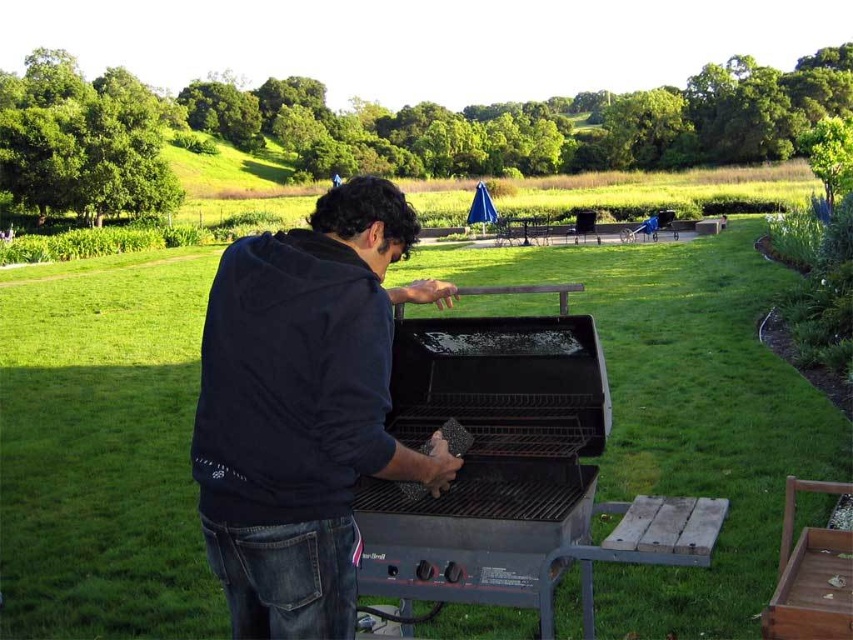
Who is lower down, dark blue hoodie at center or black matte barbecue grill at center?

Positioned lower is dark blue hoodie at center.

Can you confirm if dark blue hoodie at center is wider than black matte barbecue grill at center?

Yes.

What are the coordinates of `dark blue hoodie at center` in the screenshot? It's located at (303, 410).